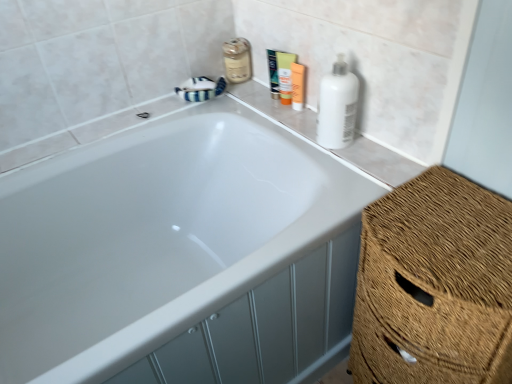
You are a GUI agent. You are given a task and a screenshot of the screen. Output one action in this format:
    pyautogui.click(x=<x>, y=<y>)
    Task: Click on the free space in front of orange matte lotion at upper center, which is counted as the 1th toiletry, starting from the right
    Image resolution: width=512 pixels, height=384 pixels.
    Given the screenshot: What is the action you would take?
    pyautogui.click(x=309, y=124)